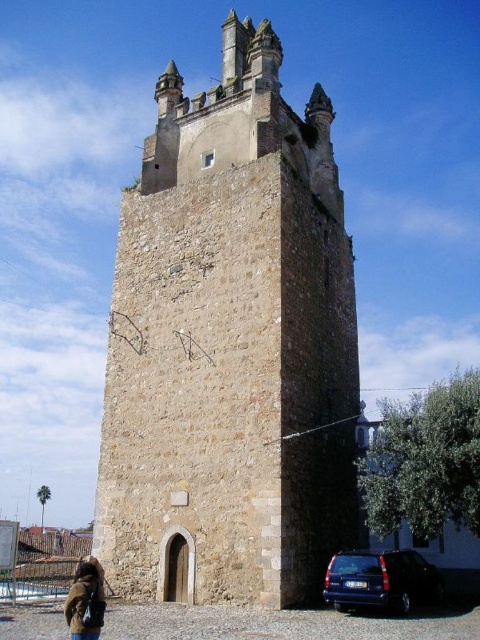
Based on the photo, you are a photographer planning to capture the brown stone tower at center and the blue metallic van at lower right in a single frame. Based on their sizes, which object will appear wider in the photo?

The brown stone tower at center will appear wider in the photo because its width is larger than the blue metallic van at lower right.

You are a photographer planning to capture the historic stone tower. You have a blue metallic van at lower right and a brown leather jacket at lower left in your shot. Which object is wider in the image?

The blue metallic van at lower right is wider than the brown leather jacket at lower left according to the description.

You are standing at the base of the historic stone tower and notice a blue metallic van at lower right and a brown leather jacket at lower left. Which object is closer to you?

The blue metallic van at lower right is positioned under brown leather jacket at lower left, meaning it is closer to you.